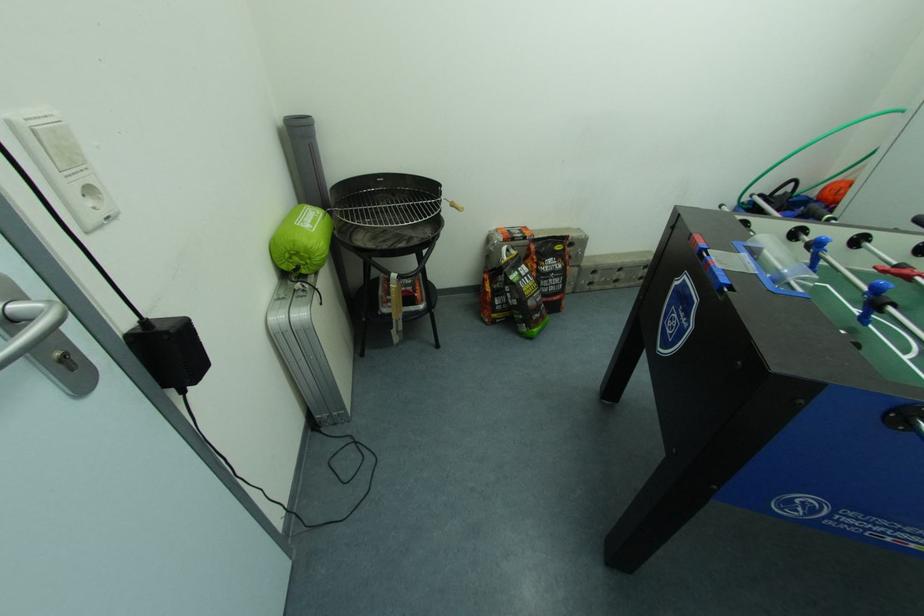
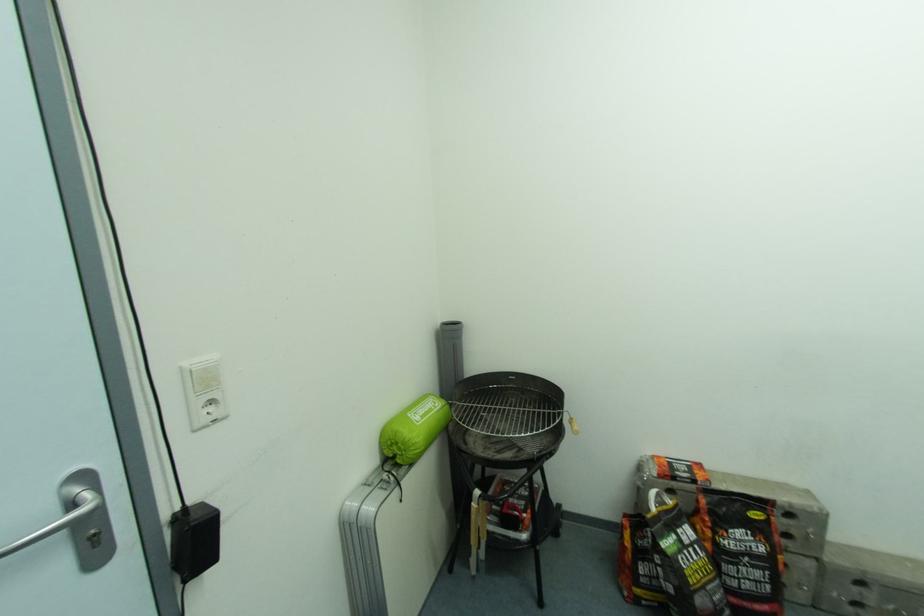
The first image is from the beginning of the video and the second image is from the end. How did the camera likely rotate when shooting the video?

The camera's rotation is toward left-up.